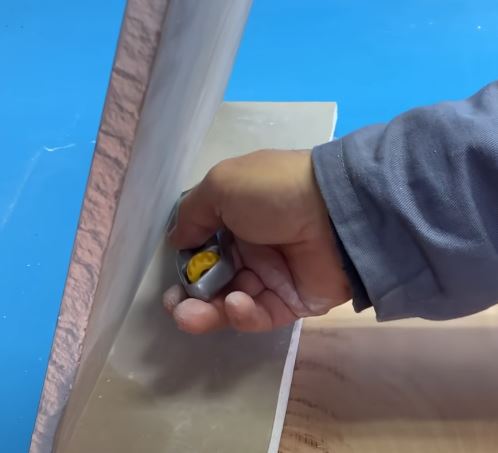
Find the location of a particular element. This screenshot has height=453, width=498. hand working on sheetrock is located at coordinates (224, 216).